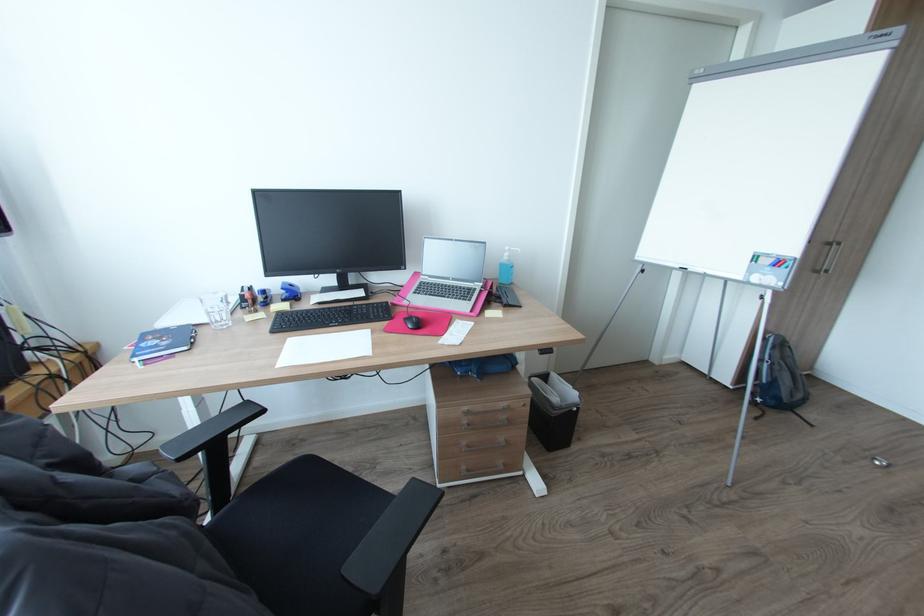
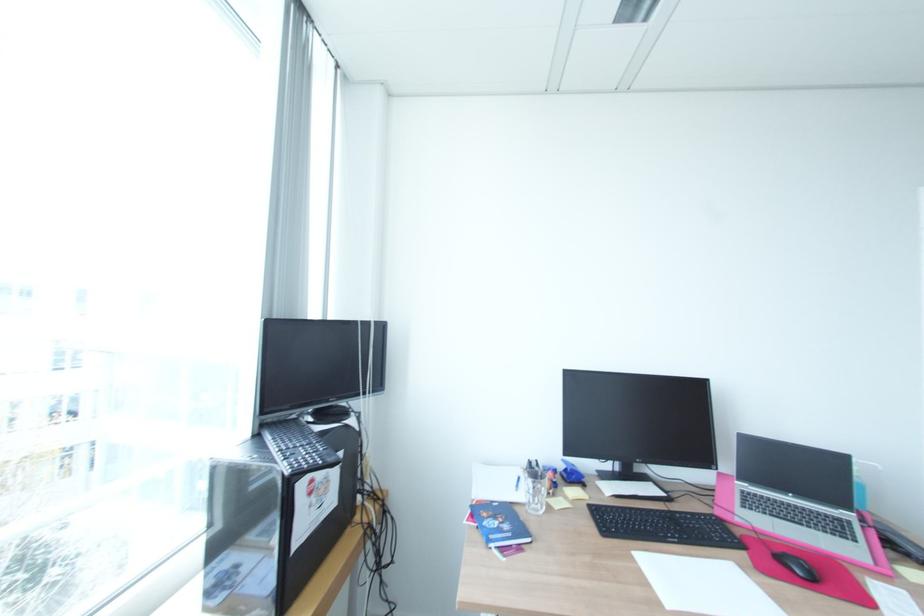
The point at (x=431, y=294) is marked in the first image. Where is the corresponding point in the second image?

(770, 513)